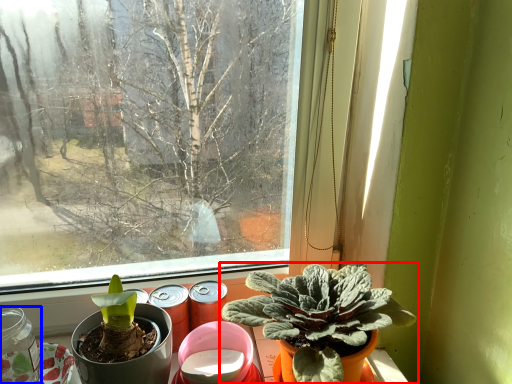
Question: Which object is further to the camera taking this photo, houseplant (highlighted by a red box) or glass jar (highlighted by a blue box)?

Choices:
 (A) houseplant
 (B) glass jar

Answer: (B)